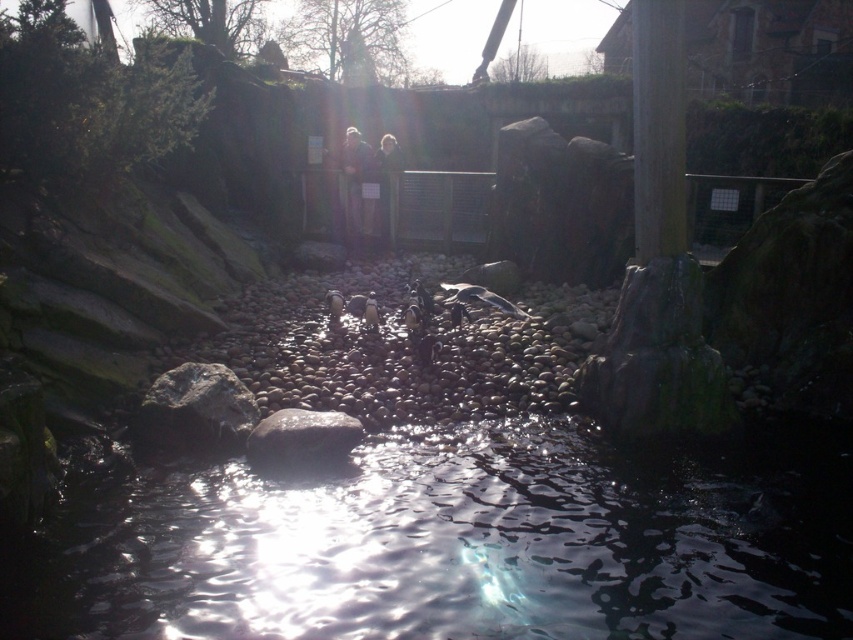
Does transparent water at center appear under smooth gray rock at center?

Yes.

Is point (846, 624) more distant than point (289, 408)?

No, (846, 624) is in front of (289, 408).

At what (x,y) coordinates should I click in order to perform the action: click on transparent water at center. Please return your answer as a coordinate pair (x, y). The image size is (853, 640). Looking at the image, I should click on (454, 545).

Can you confirm if transparent water at center is positioned to the right of smooth gray rock at lower left?

Correct, you'll find transparent water at center to the right of smooth gray rock at lower left.

Does point (733, 582) come behind point (161, 388)?

That is False.

Is point (482, 538) closer to viewer compared to point (229, 404)?

Yes.

Where is `transparent water at center`? transparent water at center is located at coordinates (454, 545).

The width and height of the screenshot is (853, 640). I want to click on smooth gray rock at lower left, so click(x=196, y=410).

Image resolution: width=853 pixels, height=640 pixels. What do you see at coordinates (196, 410) in the screenshot?
I see `smooth gray rock at lower left` at bounding box center [196, 410].

Locate an element on the screen. This screenshot has width=853, height=640. smooth gray rock at lower left is located at coordinates (196, 410).